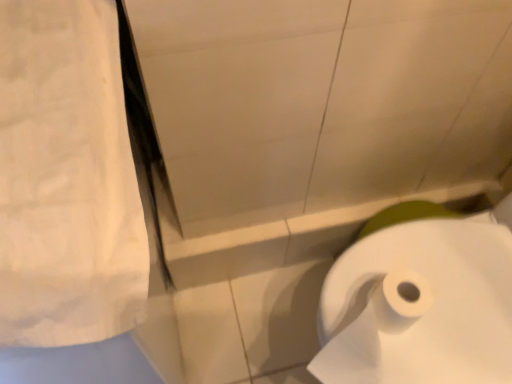
Identify the location of white cotton towel at upper left. (x=66, y=179).

The height and width of the screenshot is (384, 512). What do you see at coordinates (66, 179) in the screenshot? I see `white cotton towel at upper left` at bounding box center [66, 179].

What is the approximate width of white cotton towel at upper left?

white cotton towel at upper left is 23.83 inches wide.

The width and height of the screenshot is (512, 384). What do you see at coordinates (419, 306) in the screenshot? I see `white paper at lower right` at bounding box center [419, 306].

Where is `white paper at lower right`? Image resolution: width=512 pixels, height=384 pixels. white paper at lower right is located at coordinates (419, 306).

Where is `white cotton towel at upper left`? This screenshot has width=512, height=384. white cotton towel at upper left is located at coordinates (66, 179).

Does white cotton towel at upper left appear on the right side of white paper at lower right?

No.

Which object is closer to the camera, white cotton towel at upper left or white paper at lower right?

white cotton towel at upper left is more forward.

Considering the positions of point (38, 312) and point (447, 375), is point (38, 312) closer or farther from the camera than point (447, 375)?

Clearly, point (38, 312) is closer to the camera than point (447, 375).

From the image's perspective, between white cotton towel at upper left and white paper at lower right, which one is located above?

white cotton towel at upper left, from the image's perspective.

From a real-world perspective, is white cotton towel at upper left physically below white paper at lower right?

No, from a real-world perspective, white cotton towel at upper left is not below white paper at lower right.

Considering the sizes of objects white cotton towel at upper left and white paper at lower right in the image provided, who is thinner, white cotton towel at upper left or white paper at lower right?

Thinner between the two is white paper at lower right.

Does white cotton towel at upper left have a lesser height compared to white paper at lower right?

Yes, white cotton towel at upper left is shorter than white paper at lower right.

Considering the sizes of objects white cotton towel at upper left and white paper at lower right in the image provided, who is smaller, white cotton towel at upper left or white paper at lower right?

white paper at lower right.

Is white cotton towel at upper left situated inside white paper at lower right or outside?

white cotton towel at upper left exists outside the volume of white paper at lower right.

From the picture: Are white cotton towel at upper left and white paper at lower right making contact?

No, white cotton towel at upper left is not next to white paper at lower right.

Is white cotton towel at upper left aimed at white paper at lower right?

No, white cotton towel at upper left is not facing towards white paper at lower right.

How many degrees apart are the facing directions of white cotton towel at upper left and white paper at lower right?

white cotton towel at upper left and white paper at lower right are facing 84.5 degrees away from each other.

I want to click on toilet paper on the right of white cotton towel at upper left, so click(x=419, y=306).

Consider the image. Considering the relative positions of white paper at lower right and white cotton towel at upper left in the image provided, is white paper at lower right to the left of white cotton towel at upper left from the viewer's perspective?

No, white paper at lower right is not to the left of white cotton towel at upper left.

Considering their positions, is white paper at lower right located in front of or behind white cotton towel at upper left?

Visually, white paper at lower right is located behind white cotton towel at upper left.

Which is nearer, (398, 309) or (121, 228)?

Point (398, 309) is farther from the camera than point (121, 228).

From the image's perspective, is white paper at lower right over white cotton towel at upper left?

No, from the image's perspective, white paper at lower right is not above white cotton towel at upper left.

From a real-world perspective, is white paper at lower right on top of white cotton towel at upper left?

No.

Looking at their sizes, would you say white paper at lower right is wider or thinner than white cotton towel at upper left?

Considering their sizes, white paper at lower right looks slimmer than white cotton towel at upper left.

Can you confirm if white paper at lower right is taller than white cotton towel at upper left?

Correct, white paper at lower right is much taller as white cotton towel at upper left.

Based on their sizes in the image, would you say white paper at lower right is bigger or smaller than white cotton towel at upper left?

Considering their sizes, white paper at lower right takes up less space than white cotton towel at upper left.

Is white cotton towel at upper left located within white paper at lower right?

No, white paper at lower right does not contain white cotton towel at upper left.

Are white paper at lower right and white cotton towel at upper left beside each other?

No, white paper at lower right is not with white cotton towel at upper left.

Could you tell me if white paper at lower right is facing white cotton towel at upper left?

No, white paper at lower right is not facing towards white cotton towel at upper left.

Identify the location of linen in front of the white paper at lower right. (66, 179).

At what (x,y) coordinates should I click in order to perform the action: click on toilet paper below the white cotton towel at upper left (from the image's perspective). Please return your answer as a coordinate pair (x, y). Looking at the image, I should click on (419, 306).

At what (x,y) coordinates should I click in order to perform the action: click on linen above the white paper at lower right (from the image's perspective). Please return your answer as a coordinate pair (x, y). The width and height of the screenshot is (512, 384). Looking at the image, I should click on (66, 179).